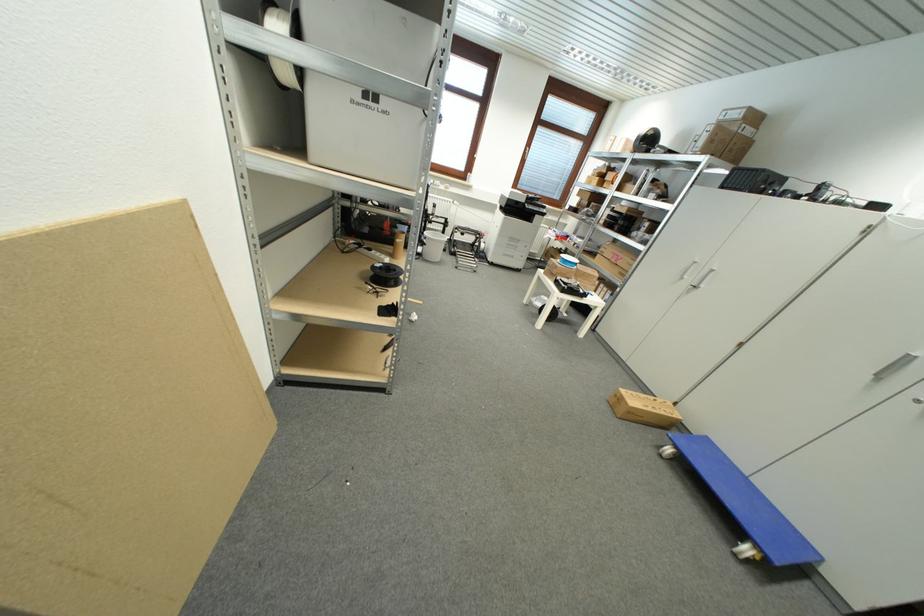
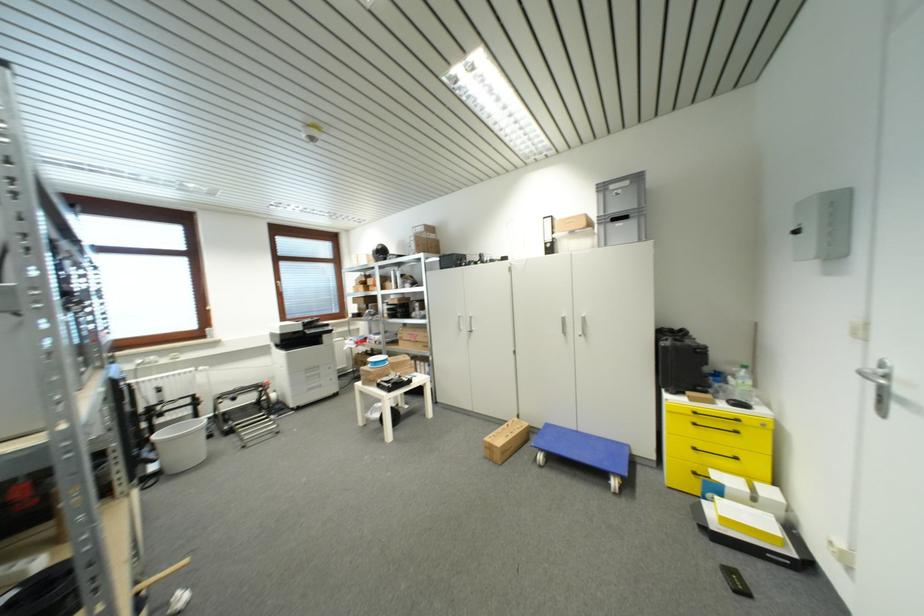
Locate, in the second image, the point that corresponds to the point at 663,402 in the first image.

(514, 426)